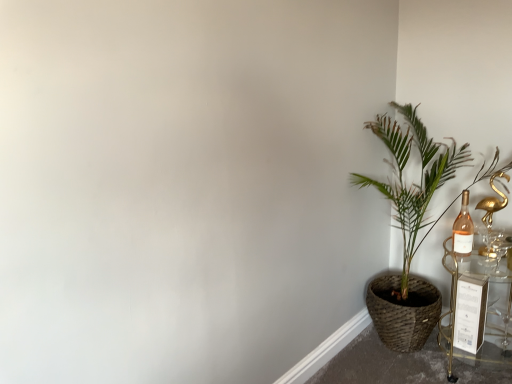
In order to click on gold metallic table at right in this screenshot , I will do `click(456, 302)`.

Find the location of `pink glass bottle at right`. pink glass bottle at right is located at coordinates (463, 229).

At what (x,y) coordinates should I click in order to perform the action: click on gold metallic table at right. Please return your answer as a coordinate pair (x, y). Looking at the image, I should click on (456, 302).

Considering the sizes of objects green woven basket at right and pink glass bottle at right in the image provided, who is bigger, green woven basket at right or pink glass bottle at right?

Bigger between the two is green woven basket at right.

In the scene shown: From the image's perspective, which is above, green woven basket at right or pink glass bottle at right?

From the image's view, pink glass bottle at right is above.

How different are the orientations of green woven basket at right and pink glass bottle at right in degrees?

green woven basket at right and pink glass bottle at right are facing 0.344 degrees away from each other.

Image resolution: width=512 pixels, height=384 pixels. I want to click on bottle lying above the green woven basket at right (from the image's perspective), so click(463, 229).

Considering the relative sizes of gold metallic swan at right and gold metallic table at right in the image provided, is gold metallic swan at right bigger than gold metallic table at right?

Actually, gold metallic swan at right might be smaller than gold metallic table at right.

Is gold metallic swan at right with gold metallic table at right?

No, gold metallic swan at right is not with gold metallic table at right.

From a real-world perspective, does gold metallic swan at right sit lower than gold metallic table at right?

No, from a real-world perspective, gold metallic swan at right is not beneath gold metallic table at right.

From the image's perspective, which is above, gold metallic swan at right or gold metallic table at right?

gold metallic swan at right appears higher in the image.

Would you say pink glass bottle at right is part of gold metallic table at right's contents?

Yes, pink glass bottle at right is surrounded by gold metallic table at right.

From their relative heights in the image, would you say gold metallic table at right is taller or shorter than pink glass bottle at right?

Clearly, gold metallic table at right is taller compared to pink glass bottle at right.

Which is farther, (444, 350) or (462, 214)?

Point (444, 350)

Based on their positions, is gold metallic table at right located to the left or right of gold metallic swan at right?

Clearly, gold metallic table at right is on the left of gold metallic swan at right in the image.

From the image's perspective, does gold metallic table at right appear lower than gold metallic swan at right?

Yes, from the image's perspective, gold metallic table at right is beneath gold metallic swan at right.

From the picture: Is gold metallic table at right in front of or behind gold metallic swan at right in the image?

In the image, gold metallic table at right appears in front of gold metallic swan at right.

From a real-world perspective, is gold metallic swan at right under pink glass bottle at right?

Actually, gold metallic swan at right is physically above pink glass bottle at right in the real world.

Looking at the image, does gold metallic swan at right seem bigger or smaller compared to pink glass bottle at right?

Considering their sizes, gold metallic swan at right takes up more space than pink glass bottle at right.

This screenshot has height=384, width=512. Identify the location of bottle behind the gold metallic swan at right. tap(463, 229).

Is green woven basket at right next to gold metallic swan at right and touching it?

No, green woven basket at right is not with gold metallic swan at right.

Based on the photo, is green woven basket at right aimed at gold metallic swan at right?

Yes.

Considering the relative sizes of green woven basket at right and gold metallic swan at right in the image provided, is green woven basket at right smaller than gold metallic swan at right?

Incorrect, green woven basket at right is not smaller in size than gold metallic swan at right.

From the image's perspective, which is below, green woven basket at right or gold metallic swan at right?

green woven basket at right appears lower in the image.

Based on the photo, from the image's perspective, is pink glass bottle at right on gold metallic table at right?

Yes, from the image's perspective, pink glass bottle at right is above gold metallic table at right.

Between pink glass bottle at right and gold metallic table at right, which one has larger width?

gold metallic table at right.

Considering the sizes of objects pink glass bottle at right and gold metallic table at right in the image provided, who is taller, pink glass bottle at right or gold metallic table at right?

Standing taller between the two is gold metallic table at right.

At what (x,y) coordinates should I click in order to perform the action: click on bottle behind the green woven basket at right. Please return your answer as a coordinate pair (x, y). Looking at the image, I should click on (463, 229).

Identify the location of candle holder on the right of gold metallic table at right. (493, 200).

Looking at the image, which one is located closer to green woven basket at right, gold metallic swan at right or pink glass bottle at right?

Among the two, pink glass bottle at right is located nearer to green woven basket at right.

Based on their spatial positions, is pink glass bottle at right or green woven basket at right further from gold metallic swan at right?

green woven basket at right lies further to gold metallic swan at right than the other object.

Estimate the real-world distances between objects in this image. Which object is further from gold metallic table at right, green woven basket at right or pink glass bottle at right?

Based on the image, green woven basket at right appears to be further to gold metallic table at right.

Which object lies nearer to the anchor point gold metallic table at right, green woven basket at right or gold metallic swan at right?

green woven basket at right lies closer to gold metallic table at right than the other object.

Consider the image. When comparing their distances from gold metallic swan at right, does green woven basket at right or pink glass bottle at right seem closer?

pink glass bottle at right.

When comparing their distances from green woven basket at right, does pink glass bottle at right or gold metallic swan at right seem closer?

pink glass bottle at right.

Based on their spatial positions, is gold metallic swan at right or green woven basket at right closer to pink glass bottle at right?

Among the two, gold metallic swan at right is located nearer to pink glass bottle at right.

Estimate the real-world distances between objects in this image. Which object is closer to pink glass bottle at right, green woven basket at right or gold metallic swan at right?

The object closer to pink glass bottle at right is gold metallic swan at right.

This screenshot has height=384, width=512. I want to click on table between green woven basket at right and pink glass bottle at right along the z-axis, so click(x=456, y=302).

This screenshot has width=512, height=384. What are the coordinates of `bottle that lies between gold metallic swan at right and gold metallic table at right from top to bottom` in the screenshot? It's located at (463, 229).

Find the location of a particular element. candle holder between green woven basket at right and pink glass bottle at right in the front-back direction is located at coordinates (493, 200).

Identify the location of houseplant between gold metallic swan at right and gold metallic table at right in the up-down direction. The height and width of the screenshot is (384, 512). (409, 227).